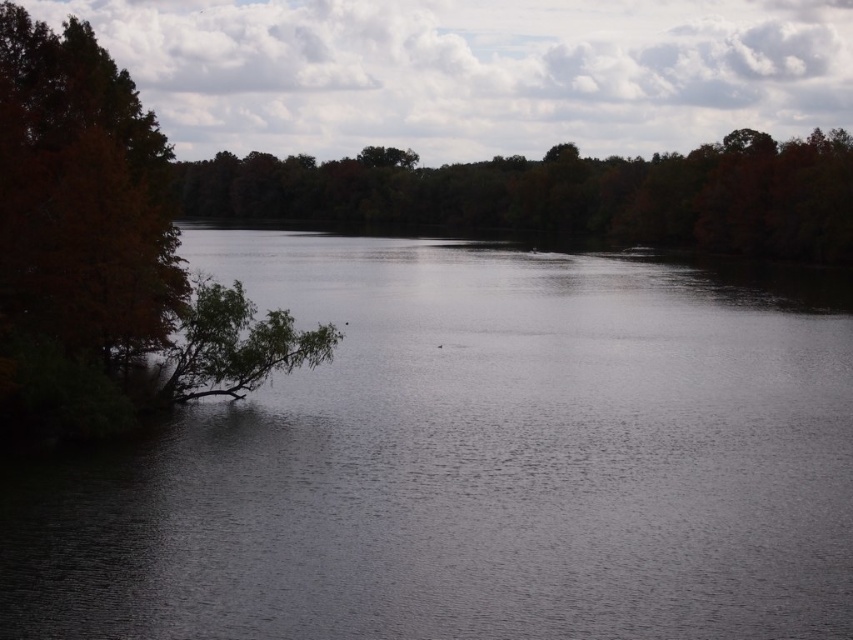
Question: Is dark water at center wider than brown matte tree at center?

Choices:
 (A) no
 (B) yes

Answer: (A)

Question: Is dark water at center positioned at the back of brown matte tree at center?

Choices:
 (A) no
 (B) yes

Answer: (A)

Question: Which point is farther to the camera?

Choices:
 (A) brown matte tree at center
 (B) dark water at center

Answer: (A)

Question: Does dark water at center appear on the left side of brown matte tree at center?

Choices:
 (A) yes
 (B) no

Answer: (A)